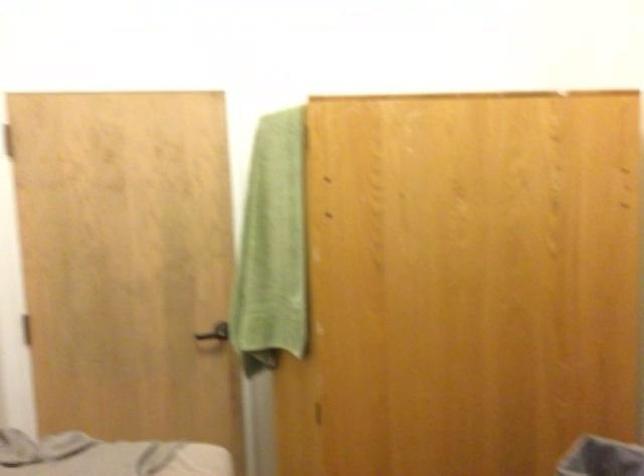
Where would you turn the black door handle? Please return your answer as a coordinate pair (x, y).

(214, 332)